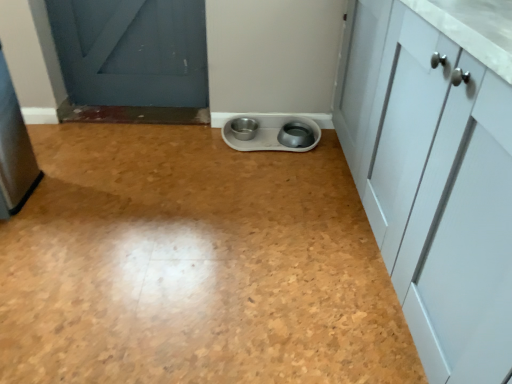
I want to click on unoccupied region to the right of brushed metal refrigerator at left, marked as the second appliance in a right-to-left arrangement, so click(x=63, y=193).